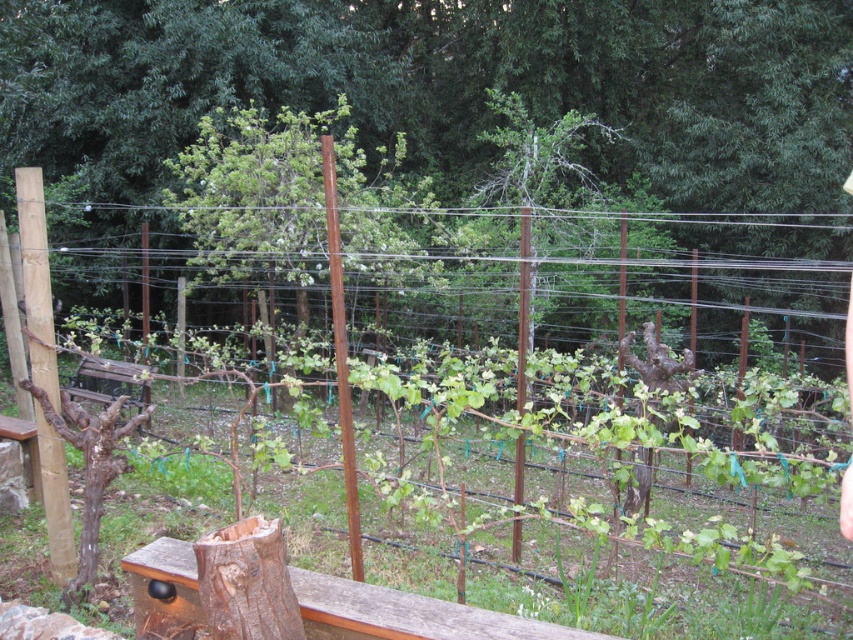
Who is lower down, brown wood tree at center or rusty wire fence at center?

rusty wire fence at center is below.

What do you see at coordinates (442, 88) in the screenshot? The image size is (853, 640). I see `brown wood tree at center` at bounding box center [442, 88].

Between point (788, 141) and point (339, 616), which one is positioned in front?

Positioned in front is point (339, 616).

The image size is (853, 640). Find the location of `brown wood tree at center`. brown wood tree at center is located at coordinates (442, 88).